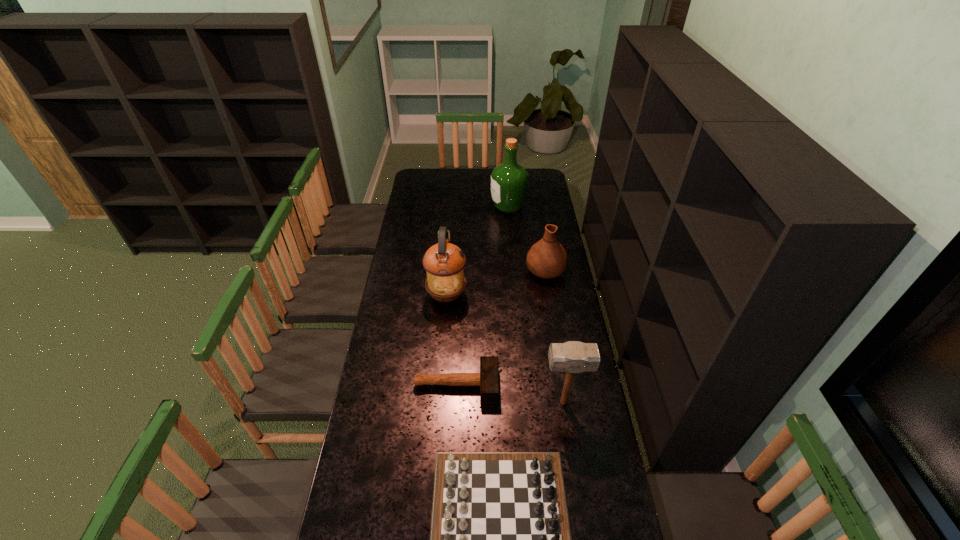
This screenshot has width=960, height=540. What are the coordinates of `the farthest object` in the screenshot? It's located at tap(509, 180).

Locate an element on the screen. The image size is (960, 540). oil lamp is located at coordinates (444, 262).

In order to click on the taller mallet in this screenshot , I will do `click(571, 357)`.

Where is `the fourth tallest object`? This screenshot has height=540, width=960. the fourth tallest object is located at coordinates (547, 259).

You are a GUI agent. You are given a task and a screenshot of the screen. Output one action in this format:
    pyautogui.click(x=<x>, y=<y>)
    Task: Click on the shorter mallet
    Image resolution: width=960 pixels, height=540 pixels.
    Given the screenshot: What is the action you would take?
    pyautogui.click(x=488, y=379)

I want to click on the left mallet, so click(488, 379).

Image resolution: width=960 pixels, height=540 pixels. I want to click on free space located on the front-facing side of the liquor, so click(444, 207).

The height and width of the screenshot is (540, 960). What are the coordinates of `blank space located 0.230m on the front-facing side of the liquor` in the screenshot? It's located at coord(450,207).

Locate an element on the screen. This screenshot has width=960, height=540. vacant space located on the front-facing side of the liquor is located at coordinates (471, 207).

Where is `blank space located 0.350m on the back of the oil lamp`? The width and height of the screenshot is (960, 540). blank space located 0.350m on the back of the oil lamp is located at coordinates (451, 237).